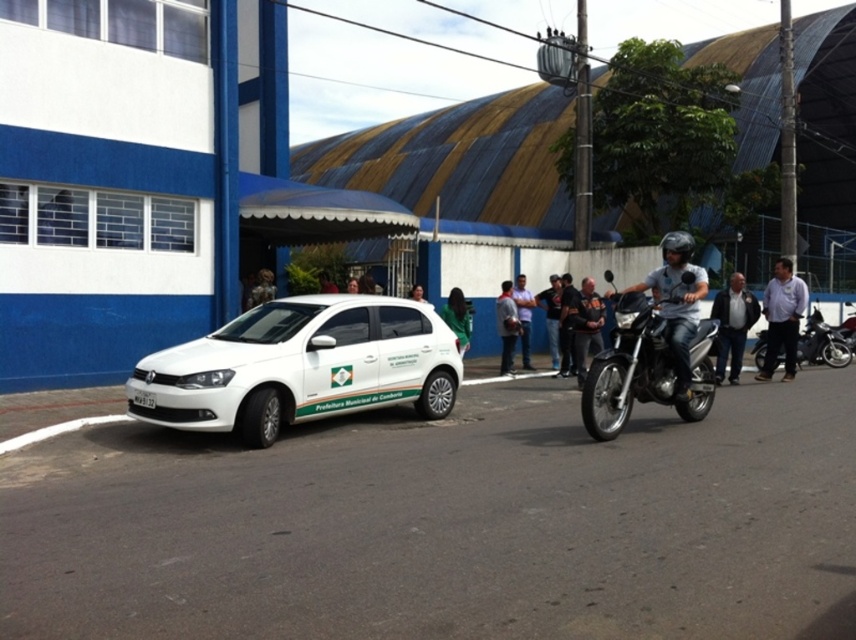
Is point (314, 348) closer to camera compared to point (524, 344)?

That is True.

Who is positioned more to the left, white matte hatchback at center or white leather jacket at center?

From the viewer's perspective, white matte hatchback at center appears more on the left side.

Is point (286, 364) positioned before point (522, 356)?

Yes.

At what (x,y) coordinates should I click in order to perform the action: click on white matte hatchback at center. Please return your answer as a coordinate pair (x, y). This screenshot has width=856, height=640. Looking at the image, I should click on (300, 365).

Is metallic silver motorcycle at right shorter than dark blue leather jacket at right?

No, metallic silver motorcycle at right is not shorter than dark blue leather jacket at right.

Which is above, metallic silver motorcycle at right or dark blue leather jacket at right?

dark blue leather jacket at right is higher up.

This screenshot has height=640, width=856. I want to click on metallic silver motorcycle at right, so coord(646,362).

Who is more forward, (521, 326) or (421, 291)?

Positioned in front is point (521, 326).

Which is above, white leather jacket at center or green fabric shirt at center?

green fabric shirt at center is higher up.

What do you see at coordinates (522, 317) in the screenshot?
I see `white leather jacket at center` at bounding box center [522, 317].

Identify the location of white leather jacket at center. (522, 317).